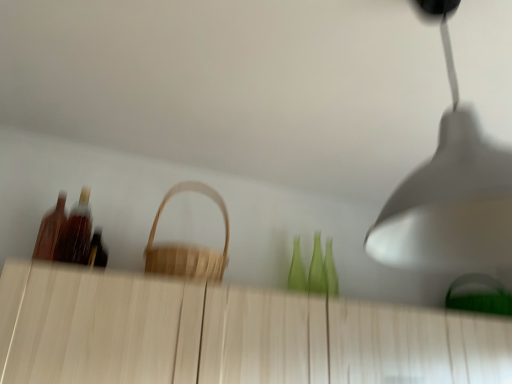
Locate an element on the screen. The width and height of the screenshot is (512, 384). empty space that is ontop of white matte lampshade at upper right (from a real-world perspective) is located at coordinates (421, 16).